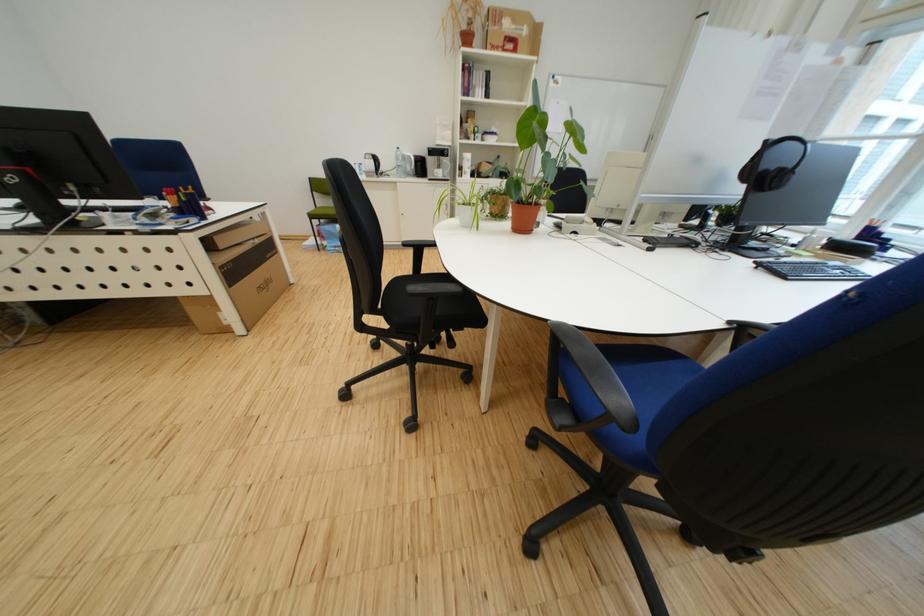
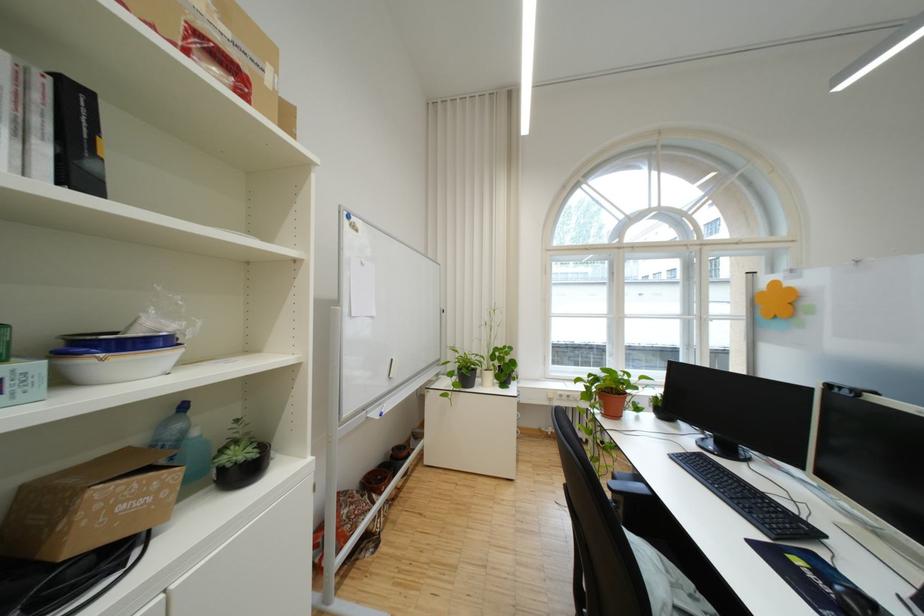
Where in the second image is the point corresponding to point (499, 140) from the first image?

(117, 365)